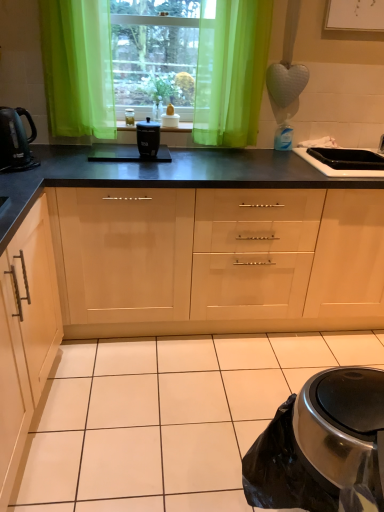
What are the coordinates of `free location in front of shiny black kettle at left` in the screenshot? It's located at (x=20, y=178).